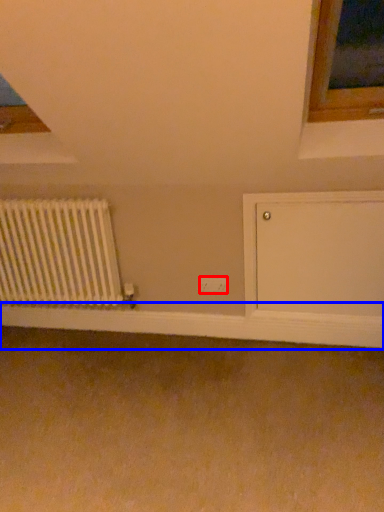
Question: Which of the following is the farthest to the observer, electric outlet (highlighted by a red box) or window sill (highlighted by a blue box)?

Choices:
 (A) electric outlet
 (B) window sill

Answer: (A)